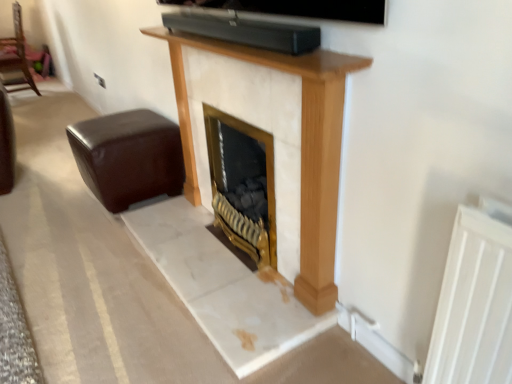
Question: Is brown leather ottoman at lower left, placed as the 2th furniture when sorted from back to front, positioned far away from brown leather ottoman at left, which appears as the 2th furniture when ordered from the bottom?

Choices:
 (A) yes
 (B) no

Answer: (A)

Question: Would you say brown leather ottoman at left, which appears as the 2th furniture when ordered from the bottom, is part of brown leather ottoman at lower left, marked as the 1th furniture in a bottom-to-top arrangement,'s contents?

Choices:
 (A) yes
 (B) no

Answer: (B)

Question: From a real-world perspective, is brown leather ottoman at lower left, arranged as the first furniture when viewed from the right, physically above brown leather ottoman at left, marked as the 1th furniture in a left-to-right arrangement?

Choices:
 (A) yes
 (B) no

Answer: (B)

Question: Is brown leather ottoman at lower left, placed as the 2th furniture when sorted from back to front, outside of brown leather ottoman at left, placed as the 1th furniture when sorted from top to bottom?

Choices:
 (A) no
 (B) yes

Answer: (B)

Question: Considering the relative positions of brown leather ottoman at lower left, placed as the 2th furniture when sorted from left to right, and brown leather ottoman at left, acting as the second furniture starting from the right, in the image provided, is brown leather ottoman at lower left, placed as the 2th furniture when sorted from left to right, to the left of brown leather ottoman at left, acting as the second furniture starting from the right, from the viewer's perspective?

Choices:
 (A) yes
 (B) no

Answer: (B)

Question: Considering the relative sizes of brown leather ottoman at lower left, placed as the 2th furniture when sorted from left to right, and brown leather ottoman at left, acting as the second furniture starting from the right, in the image provided, is brown leather ottoman at lower left, placed as the 2th furniture when sorted from left to right, shorter than brown leather ottoman at left, acting as the second furniture starting from the right,?

Choices:
 (A) no
 (B) yes

Answer: (B)

Question: From the image's perspective, is brown leather ottoman at left, which appears as the 2th furniture when ordered from the bottom, under brown leather ottoman at lower left, placed as the 2th furniture when sorted from back to front?

Choices:
 (A) no
 (B) yes

Answer: (A)

Question: Would you say brown leather ottoman at left, acting as the second furniture starting from the right, is a long distance from brown leather ottoman at lower left, placed as the 2th furniture when sorted from left to right?

Choices:
 (A) no
 (B) yes

Answer: (B)

Question: Is brown leather ottoman at left, which appears as the 2th furniture when ordered from the bottom, further to camera compared to brown leather ottoman at lower left, the 1th furniture when ordered from front to back?

Choices:
 (A) no
 (B) yes

Answer: (B)

Question: Is brown leather ottoman at left, arranged as the 1th furniture when viewed from the back, oriented towards brown leather ottoman at lower left, the 1th furniture when ordered from front to back?

Choices:
 (A) yes
 (B) no

Answer: (B)

Question: Considering the relative sizes of brown leather ottoman at left, marked as the 1th furniture in a left-to-right arrangement, and brown leather ottoman at lower left, the 1th furniture when ordered from front to back, in the image provided, is brown leather ottoman at left, marked as the 1th furniture in a left-to-right arrangement, wider than brown leather ottoman at lower left, the 1th furniture when ordered from front to back,?

Choices:
 (A) yes
 (B) no

Answer: (B)

Question: Does brown leather ottoman at left, placed as the 1th furniture when sorted from top to bottom, have a lesser width compared to brown leather ottoman at lower left, placed as the 2th furniture when sorted from left to right?

Choices:
 (A) no
 (B) yes

Answer: (B)

Question: Is brown leather ottoman at left, acting as the second furniture starting from the right, wider or thinner than brown leather ottoman at lower left, placed as the 2th furniture when sorted from left to right?

Choices:
 (A) wide
 (B) thin

Answer: (B)